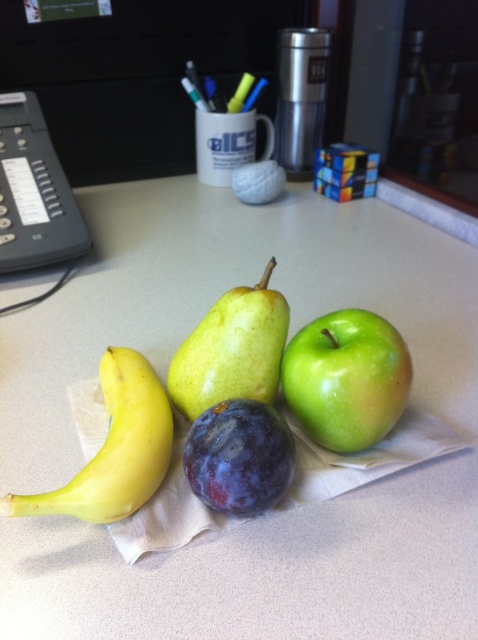
You are arranging fruits on a countertop and need to place a green matte apple at center and a yellow smooth banana at left. Which fruit is covering part of the other?

The green matte apple at center is positioned over the yellow smooth banana at left, so the apple is covering part of the banana.

You are organizing a fruit basket and need to place the green matte pear at center and the black plastic phone at upper left. Since the phone is an obstacle, which fruit should you move first to ensure the pear can be easily accessed?

The green matte pear at center is in front of the black plastic phone at upper left, so you should move the green matte pear at center first to access the area behind it.